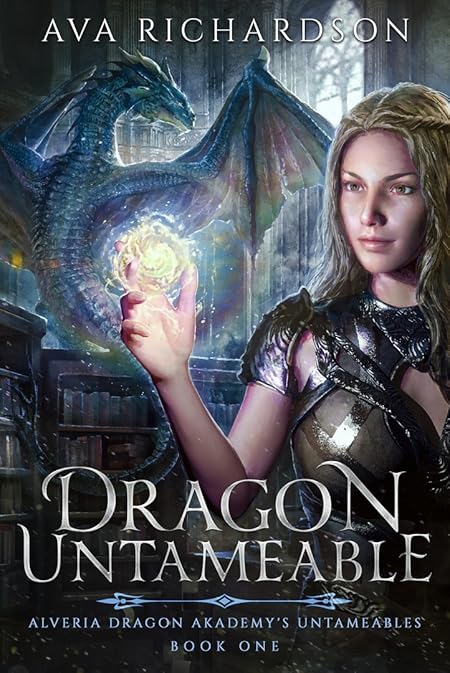
I want to click on bookcases, so click(88, 367), click(20, 330), click(223, 371).